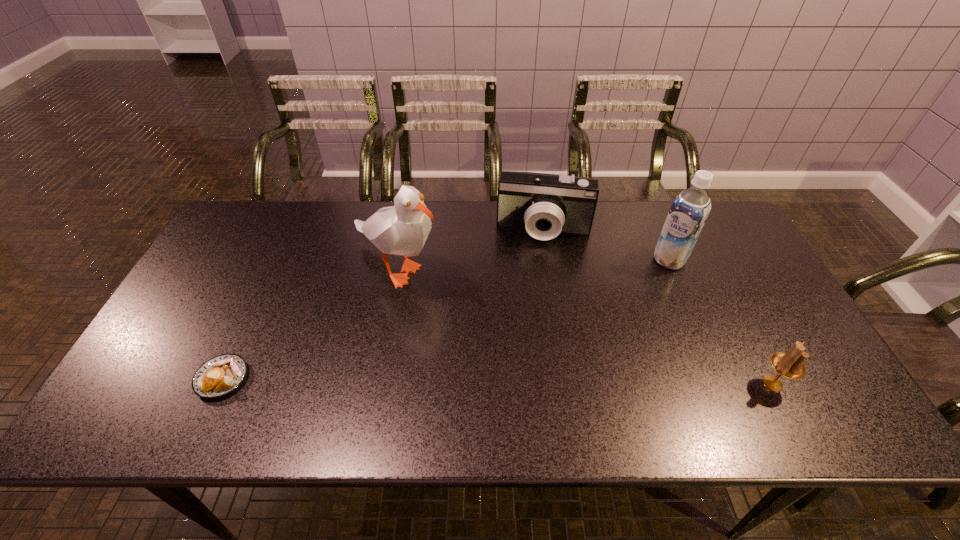
The height and width of the screenshot is (540, 960). I want to click on pastry present at the near edge, so click(220, 375).

Where is `candle holder present at the near edge`? candle holder present at the near edge is located at coordinates (790, 365).

Locate an element on the screen. object at the left edge is located at coordinates (220, 375).

Find the location of a particular element. The image size is (960, 540). object at the right edge is located at coordinates (790, 365).

The image size is (960, 540). Find the location of `object that is positioned at the near left corner`. object that is positioned at the near left corner is located at coordinates (220, 375).

What are the coordinates of `object present at the near right corner` in the screenshot? It's located at click(790, 365).

The width and height of the screenshot is (960, 540). I want to click on free space at the far edge, so (608, 225).

Where is `vacant space at the near edge of the desktop`? This screenshot has height=540, width=960. vacant space at the near edge of the desktop is located at coordinates (693, 383).

This screenshot has height=540, width=960. Identify the location of vacant position at the left edge of the desktop. (186, 333).

At what (x,y) coordinates should I click in order to perform the action: click on vacant region at the right edge. Please return your answer as a coordinate pair (x, y). Looking at the image, I should click on (738, 260).